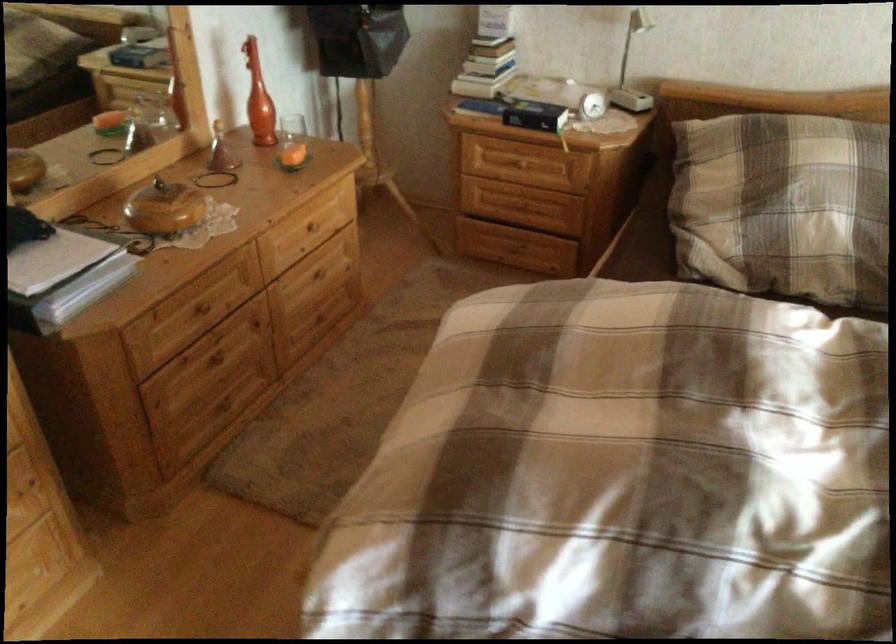
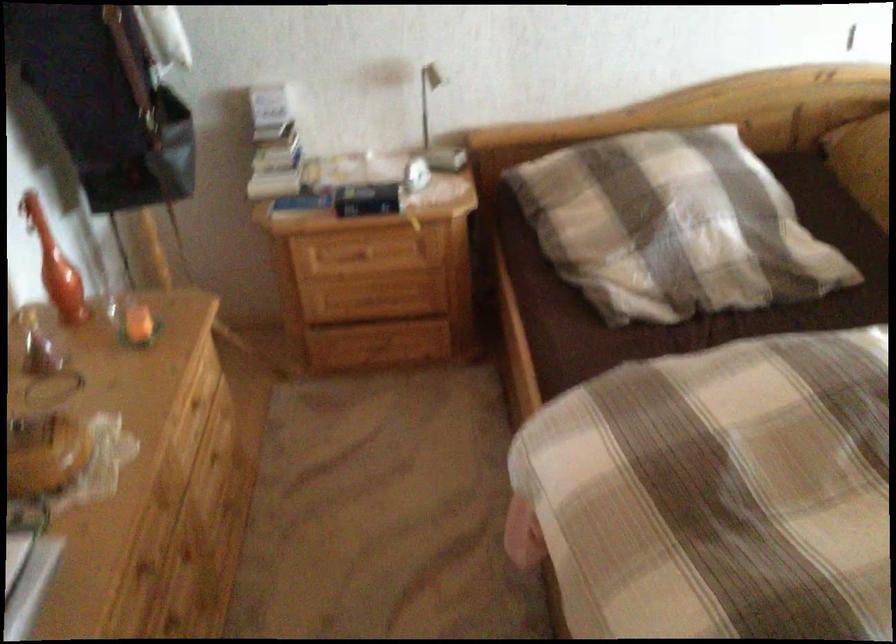
In the second image, find the point that corresponds to the point at 521,162 in the first image.

(366, 252)